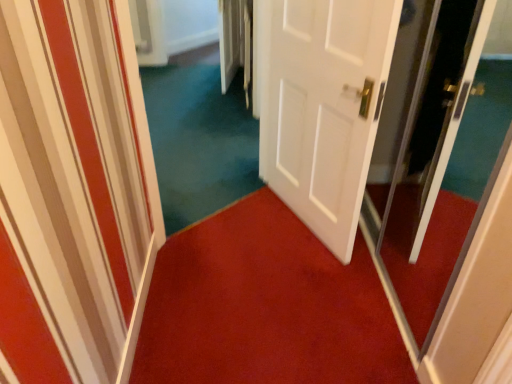
Question: Which is correct: white matte door at center is inside transparent glass screen door at right, or outside of it?

Choices:
 (A) outside
 (B) inside

Answer: (A)

Question: From a real-world perspective, is white matte door at center positioned above or below transparent glass screen door at right?

Choices:
 (A) below
 (B) above

Answer: (A)

Question: Estimate the real-world distances between objects in this image. Which object is closer to the white matte door at center?

Choices:
 (A) transparent glass screen door at right
 (B) red carpet at center
 (C) teal carpet at center

Answer: (A)

Question: Which object is the farthest from the red carpet at center?

Choices:
 (A) transparent glass screen door at right
 (B) teal carpet at center
 (C) white matte door at center

Answer: (B)